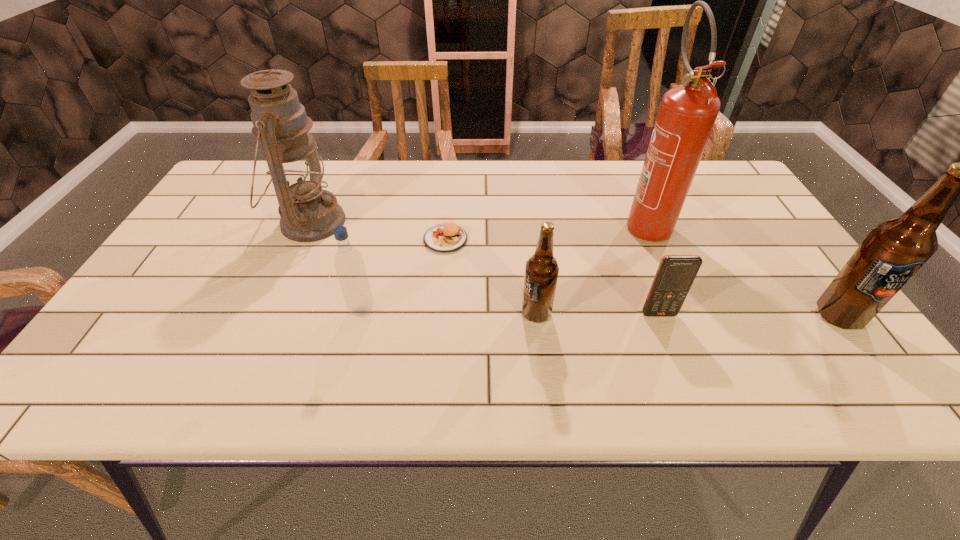
The beer bottles are evenly distributed in the image. To maintain this, where would you place another beer bottle on the left? Please point to a free space. Please provide its 2D coordinates. Your answer should be formatted as a tuple, i.e. [(x, y)], where the tuple contains the x and y coordinates of a point satisfying the conditions above.

[(236, 312)]